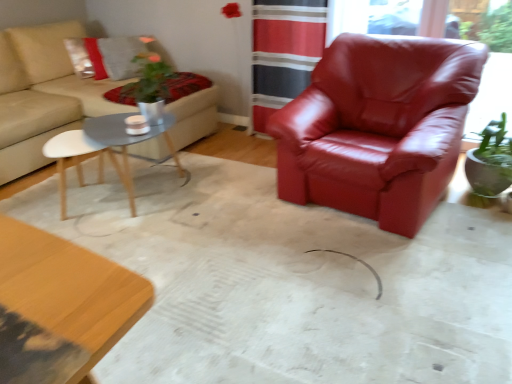
Where is `spots to the right of matte gray wood coffee table at center-left`? This screenshot has width=512, height=384. spots to the right of matte gray wood coffee table at center-left is located at coordinates (220, 200).